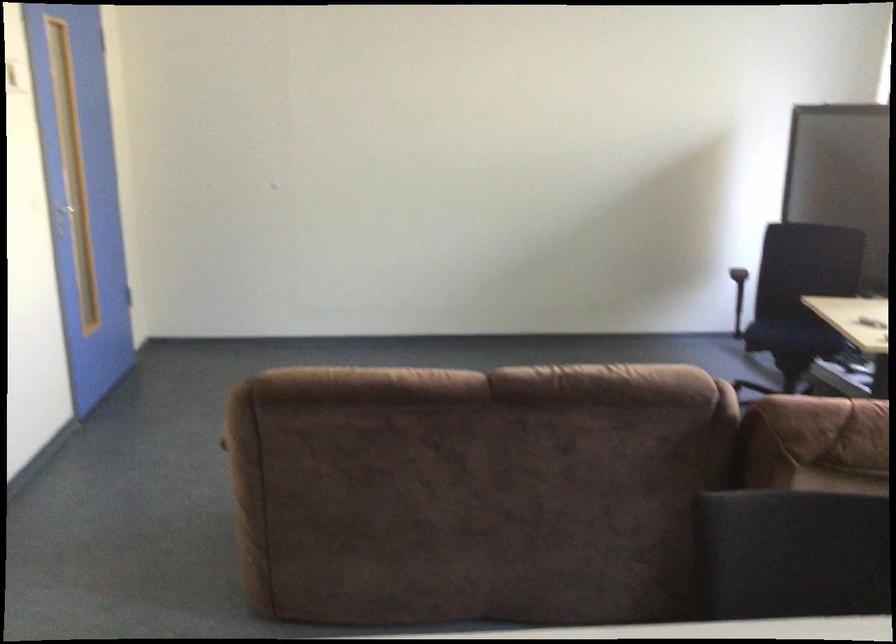
Image resolution: width=896 pixels, height=644 pixels. Identify the location of silver door handle. click(x=64, y=210).